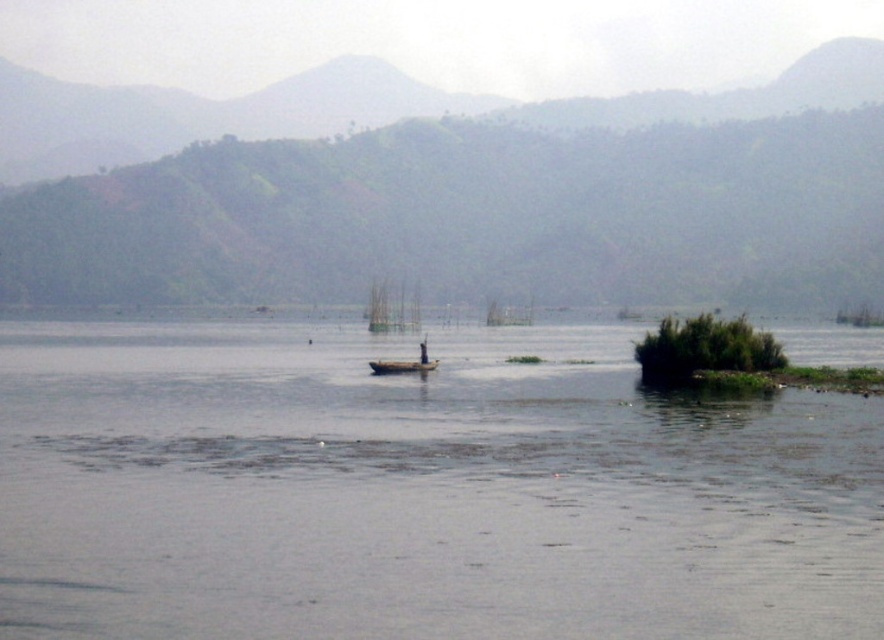
You are standing at the edge of the lake and want to determine which of the two points, point (6, 339) or point (423, 364), is closer to you. Based on the scene description, which point is nearer?

Point (6, 339) is further to the camera than point (423, 364), so the closer point to you is point (423, 364).

You are standing on the dock and want to throw a stone into the clear water at center. Based on the coordinates provided, in which direction should you aim relative to your current position?

The clear water at center is located at coordinates point (418, 492). Since the exact direction depends on the coordinate system used in the image, but generally, aiming towards the central area of the water where the coordinates point would be the correct direction.

You are standing on the shore of the lake and see both the wooden boat at center and the wooden canoe at center. Which one is positioned to the right side from your perspective?

The wooden boat at center is positioned to the right of the wooden canoe at center, so the wooden boat at center is on the right side.